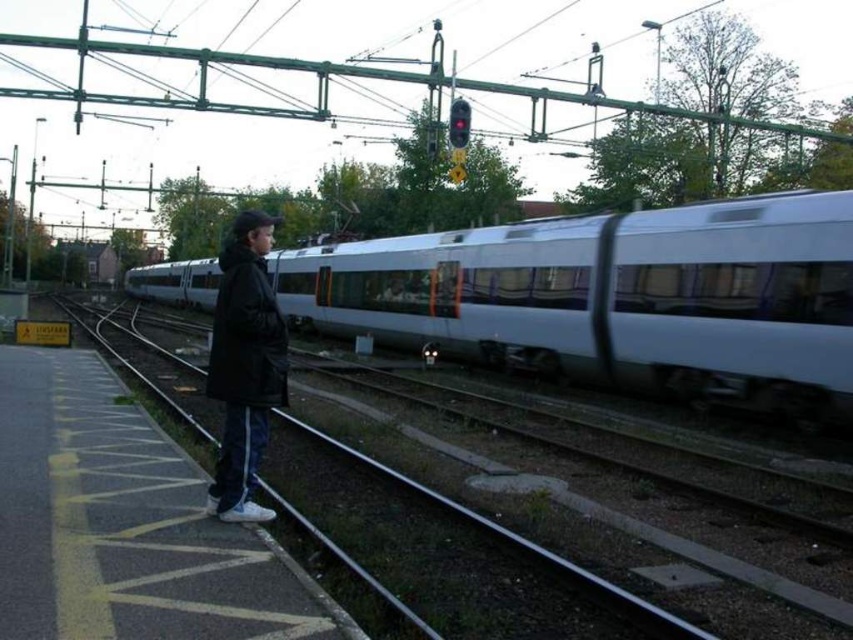
Question: Which point is farther to the camera?

Choices:
 (A) pos(811,416)
 (B) pos(236,264)

Answer: (A)

Question: From the image, what is the correct spatial relationship of silver metallic train at center in relation to black matte jacket at left?

Choices:
 (A) above
 (B) below

Answer: (B)

Question: Which object appears closest to the camera in this image?

Choices:
 (A) metallic train track at center
 (B) black matte jacket at left
 (C) silver metallic train at center

Answer: (A)

Question: Which point is farther to the camera?

Choices:
 (A) (805, 621)
 (B) (506, 269)

Answer: (B)

Question: Can you confirm if silver metallic train at center is thinner than metallic train track at center?

Choices:
 (A) yes
 (B) no

Answer: (B)

Question: In this image, where is silver metallic train at center located relative to black matte jacket at left?

Choices:
 (A) right
 (B) left

Answer: (A)